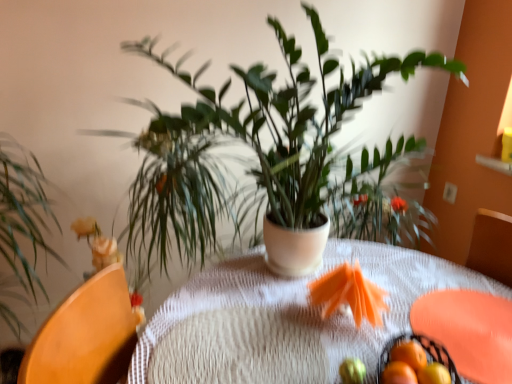
Where is `vacant space positioned to the left of smooth yellow fruit at center`? This screenshot has width=512, height=384. vacant space positioned to the left of smooth yellow fruit at center is located at coordinates (276, 359).